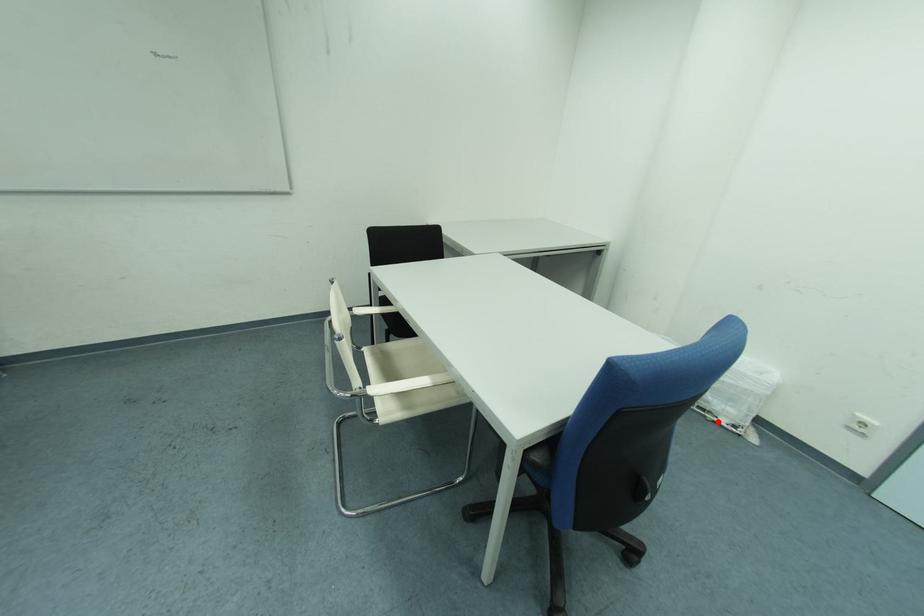
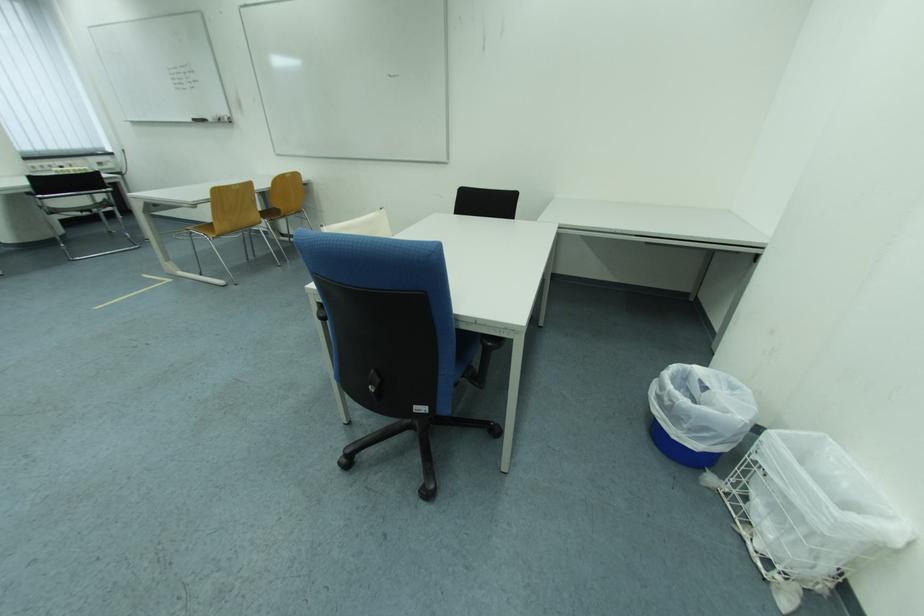
Locate, in the second image, the point that corresponds to the highlighted location in the first image.

(745, 532)